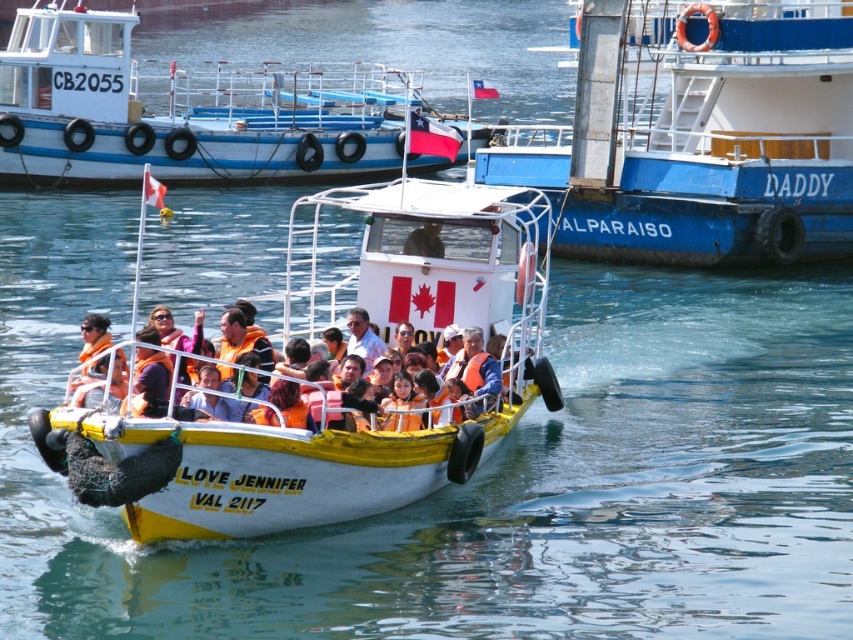
Question: Can you confirm if white matte boat at upper center is wider than orange life jacket at center?

Choices:
 (A) yes
 (B) no

Answer: (A)

Question: Does white matte boat at upper center appear on the right side of orange life vest at center?

Choices:
 (A) yes
 (B) no

Answer: (B)

Question: Which point appears farthest from the camera in this image?

Choices:
 (A) (416, 243)
 (B) (297, 387)
 (C) (233, 342)

Answer: (A)

Question: Among these objects, which one is farthest from the camera?

Choices:
 (A) smooth white helmet at center
 (B) white/yellow plastic boat at center

Answer: (A)

Question: Does blue painted metal boat at upper right lie behind orange life jacket at center?

Choices:
 (A) yes
 (B) no

Answer: (A)

Question: Which object is closer to the camera taking this photo?

Choices:
 (A) orange life jacket at center
 (B) orange life vest at center
 (C) smooth white helmet at center

Answer: (B)